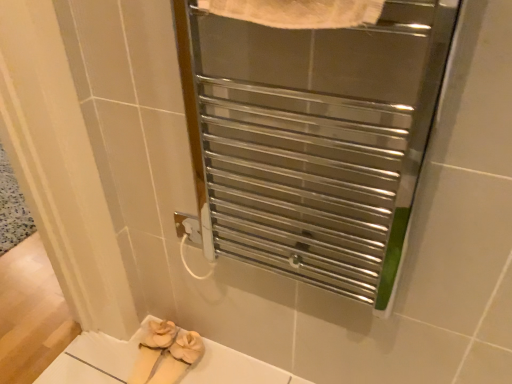
Question: From the image's perspective, is polished metal towel warmer at upper center below white soft slippers at lower center?

Choices:
 (A) yes
 (B) no

Answer: (B)

Question: Is polished metal towel warmer at upper center completely or partially outside of white soft slippers at lower center?

Choices:
 (A) no
 (B) yes

Answer: (B)

Question: Is polished metal towel warmer at upper center facing towards white soft slippers at lower center?

Choices:
 (A) yes
 (B) no

Answer: (B)

Question: From a real-world perspective, is polished metal towel warmer at upper center physically above white soft slippers at lower center?

Choices:
 (A) no
 (B) yes

Answer: (B)

Question: Is polished metal towel warmer at upper center with white soft slippers at lower center?

Choices:
 (A) no
 (B) yes

Answer: (A)

Question: From a real-world perspective, is polished metal towel warmer at upper center located beneath white soft slippers at lower center?

Choices:
 (A) yes
 (B) no

Answer: (B)

Question: Considering the relative sizes of white soft slippers at lower center and polished metal towel warmer at upper center in the image provided, is white soft slippers at lower center taller than polished metal towel warmer at upper center?

Choices:
 (A) no
 (B) yes

Answer: (A)

Question: From the image's perspective, is white soft slippers at lower center on polished metal towel warmer at upper center?

Choices:
 (A) no
 (B) yes

Answer: (A)

Question: Considering the relative sizes of white soft slippers at lower center and polished metal towel warmer at upper center in the image provided, is white soft slippers at lower center shorter than polished metal towel warmer at upper center?

Choices:
 (A) no
 (B) yes

Answer: (B)

Question: Is white soft slippers at lower center further to the viewer compared to polished metal towel warmer at upper center?

Choices:
 (A) no
 (B) yes

Answer: (B)

Question: Is white soft slippers at lower center not inside polished metal towel warmer at upper center?

Choices:
 (A) yes
 (B) no

Answer: (A)

Question: Is white soft slippers at lower center to the left of polished metal towel warmer at upper center from the viewer's perspective?

Choices:
 (A) yes
 (B) no

Answer: (A)

Question: Is white soft slippers at lower center to the left or to the right of polished metal towel warmer at upper center in the image?

Choices:
 (A) right
 (B) left

Answer: (B)